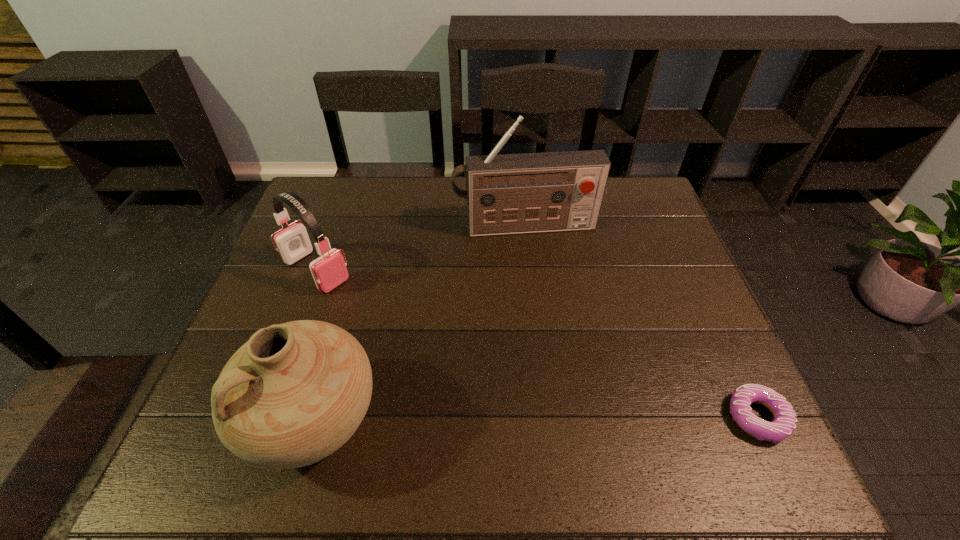
At what (x,y) coordinates should I click in order to perform the action: click on vacant space positioned 0.130m on the outer surface of the second farthest object. Please return your answer as a coordinate pair (x, y). This screenshot has height=540, width=960. Looking at the image, I should click on (372, 312).

Where is `vacant space located 0.390m on the front panel of the tallest object`? The image size is (960, 540). vacant space located 0.390m on the front panel of the tallest object is located at coordinates (561, 348).

I want to click on vacant space located on the front panel of the tallest object, so click(544, 285).

Find the location of a particular element. Image resolution: width=960 pixels, height=540 pixels. free spot located 0.220m on the front panel of the tallest object is located at coordinates (547, 293).

Locate an element on the screen. object situated at the far edge is located at coordinates (506, 194).

Find the location of `pottery that is at the near edge`. pottery that is at the near edge is located at coordinates (296, 392).

Identify the location of doughnut positioned at the near edge. (784, 423).

Image resolution: width=960 pixels, height=540 pixels. Identify the location of pottery positioned at the left edge. (296, 392).

Identify the location of earphone at the left edge. (329, 270).

I want to click on object that is at the right edge, so click(784, 423).